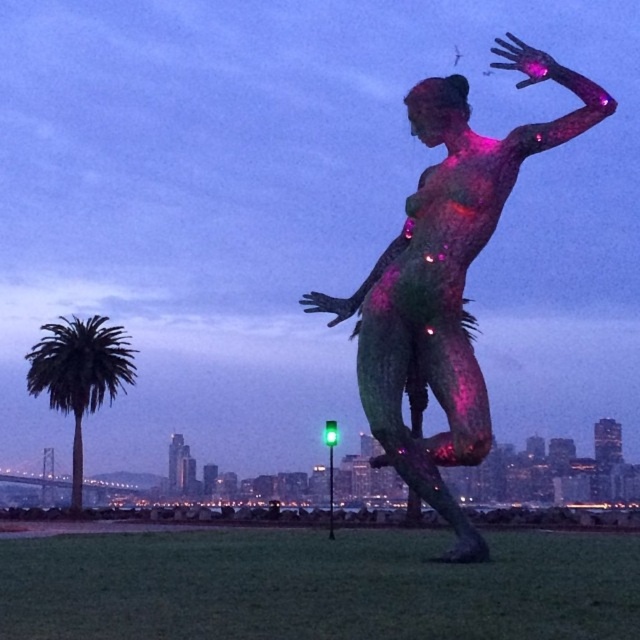
Which is more to the right, translucent pinkish-purple figure at center or green leafy palm tree at left?

translucent pinkish-purple figure at center

Does translucent pinkish-purple figure at center have a greater width compared to green leafy palm tree at left?

Correct, the width of translucent pinkish-purple figure at center exceeds that of green leafy palm tree at left.

The height and width of the screenshot is (640, 640). Find the location of `translucent pinkish-purple figure at center`. translucent pinkish-purple figure at center is located at coordinates (445, 282).